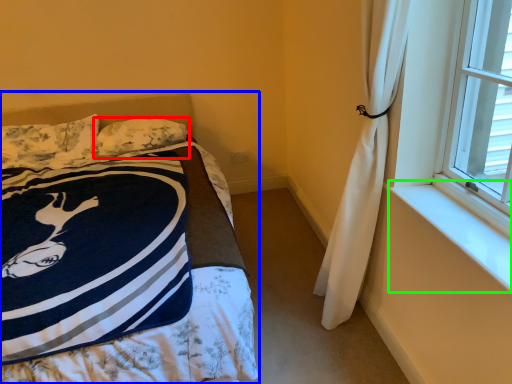
Question: Which object is positioned closest to pillow (highlighted by a red box)? Select from bed (highlighted by a blue box) and window sill (highlighted by a green box).

Choices:
 (A) bed
 (B) window sill

Answer: (A)